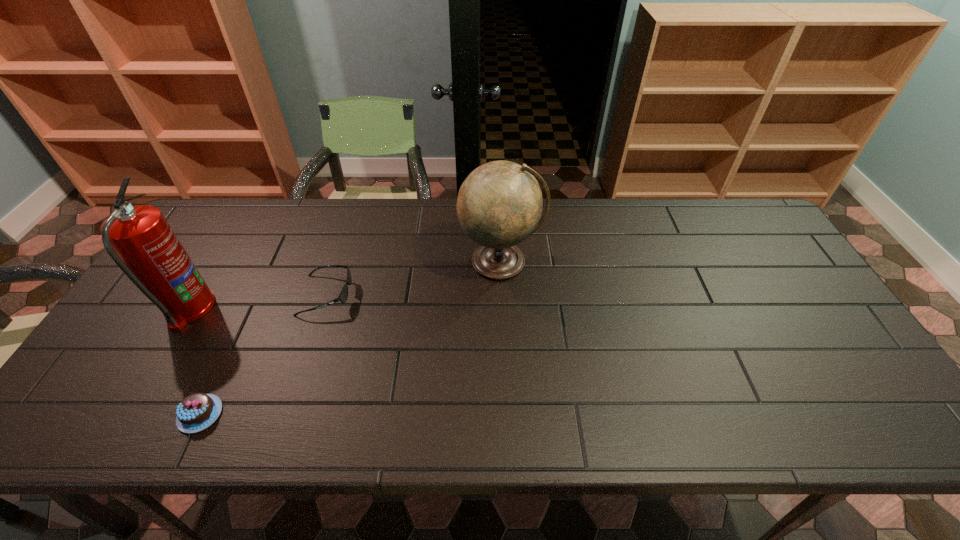
Find the location of a particular element. free space that is in between the fire extinguisher and the second object from right to left is located at coordinates (257, 302).

The height and width of the screenshot is (540, 960). What are the coordinates of `empty location between the chocolate cake and the third object from left to right` in the screenshot? It's located at (263, 355).

Locate an element on the screen. This screenshot has width=960, height=540. object that is the second nearest to the shortest object is located at coordinates (343, 295).

Locate which object ranks second in proximity to the globe. Please provide its 2D coordinates. Your answer should be formatted as a tuple, i.e. [(x, y)], where the tuple contains the x and y coordinates of a point satisfying the conditions above.

[(196, 412)]

This screenshot has height=540, width=960. In order to click on vacant area that satisfies the following two spatial constraints: 1. on the front-facing side of the rightmost object; 2. on the instruction side of the fire extinguisher in this screenshot , I will do tap(503, 309).

The image size is (960, 540). Find the location of `vacant area that satisfies the following two spatial constraints: 1. on the front-facing side of the globe; 2. on the front-facing side of the third object from left to right`. vacant area that satisfies the following two spatial constraints: 1. on the front-facing side of the globe; 2. on the front-facing side of the third object from left to right is located at coordinates (502, 295).

Locate an element on the screen. Image resolution: width=960 pixels, height=540 pixels. free space that satisfies the following two spatial constraints: 1. on the instruction side of the fire extinguisher; 2. on the back side of the third object from right to left is located at coordinates tap(126, 414).